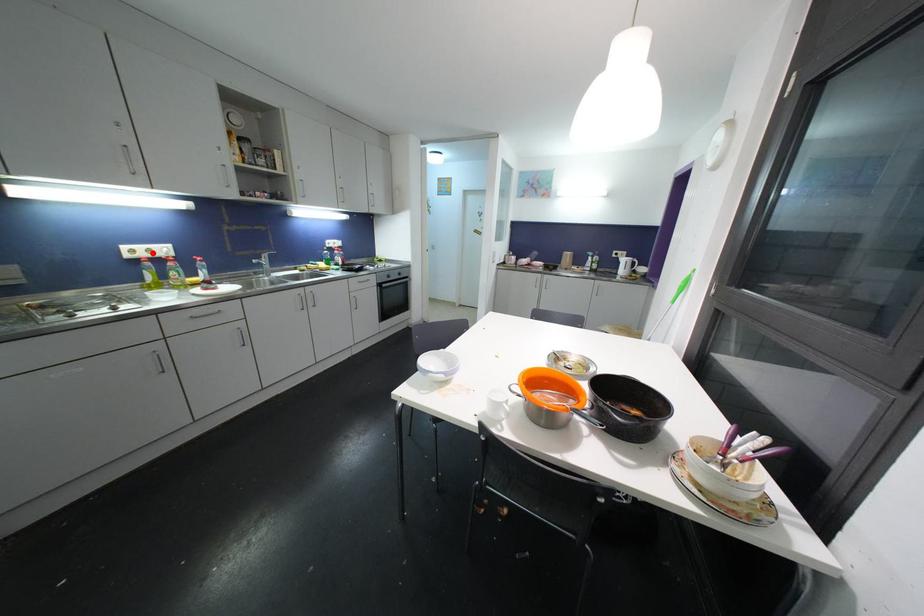
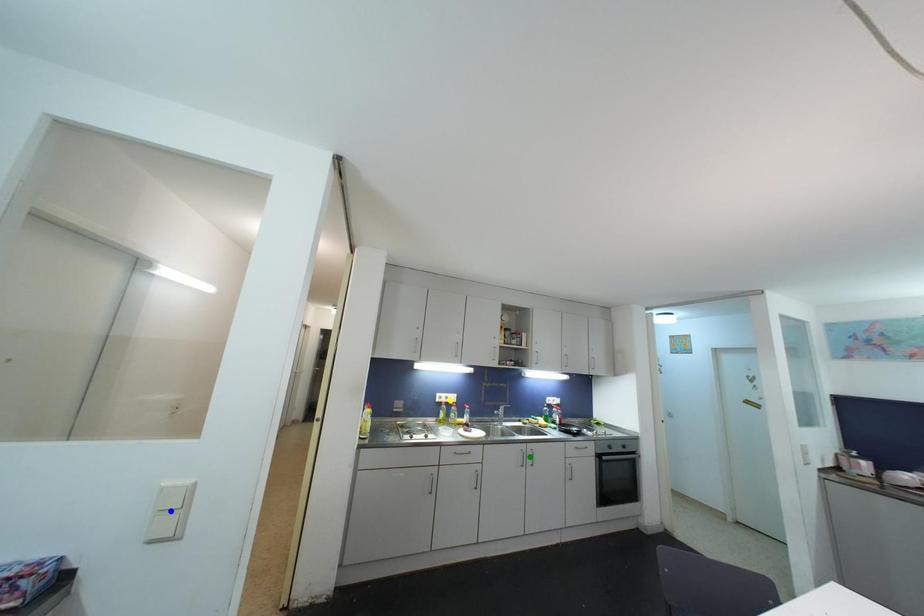
Question: I am providing you with two images of the same scene from different viewpoints. A red point is marked on the first image. You are given multiple points on the second image. Which spot in image 2 lines up with the point in image 1?

Choices:
 (A) yellow point
 (B) green point
 (C) blue point

Answer: (A)